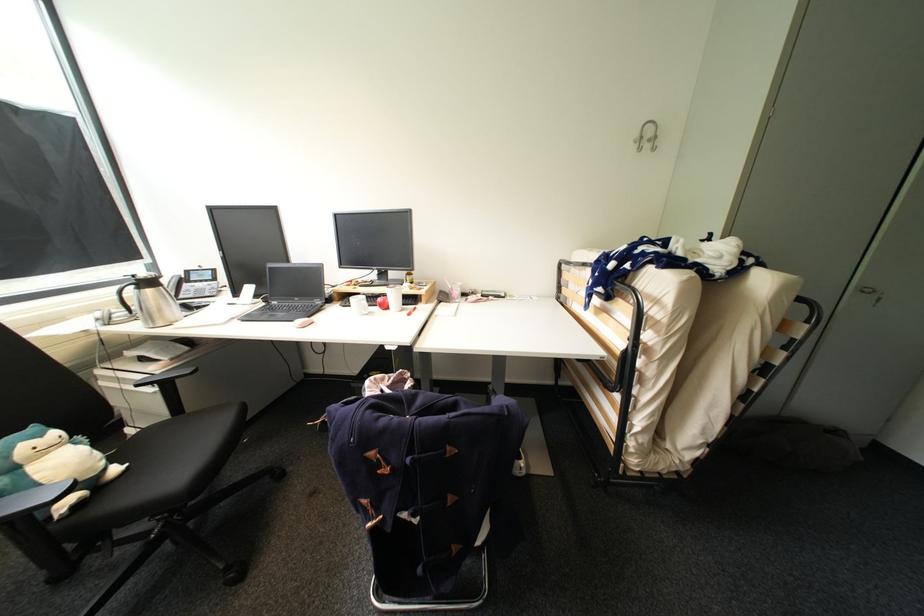
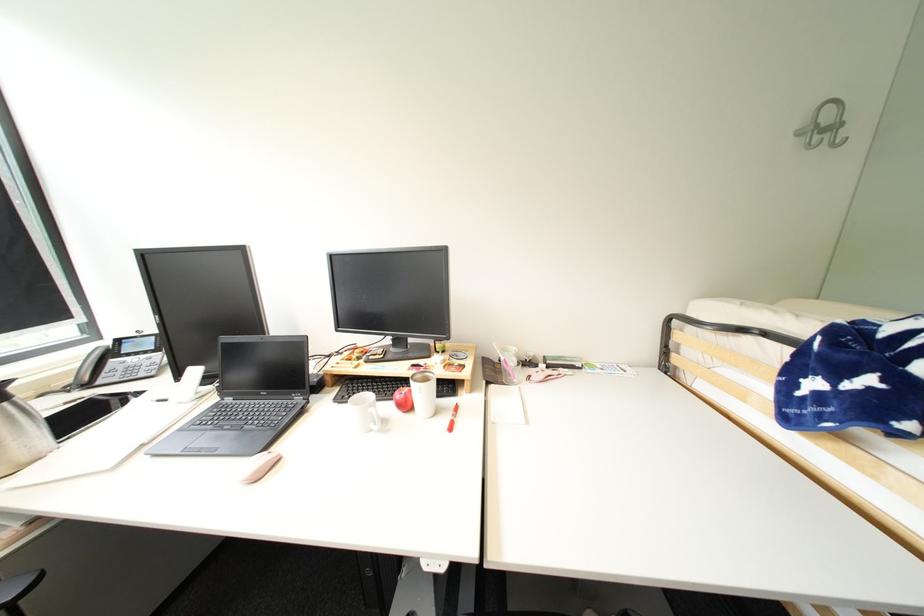
The point at (660, 140) is marked in the first image. Where is the corresponding point in the second image?

(841, 128)